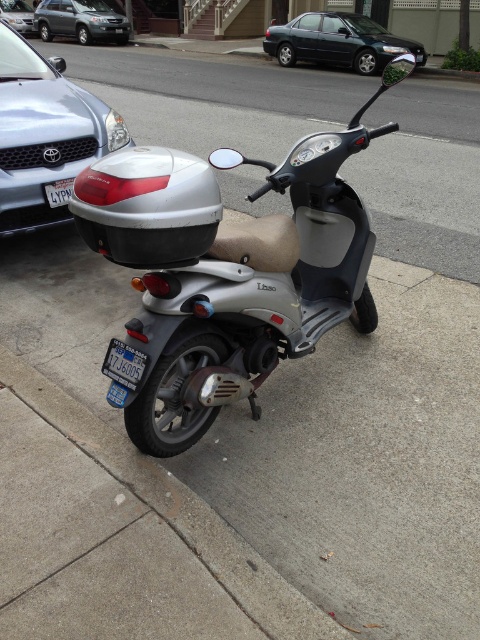
You are standing on the sidewalk and see a point marked at coordinates (x=228, y=269). What object is located at that point?

The point at coordinates (x=228, y=269) indicates the silver metallic scooter at center.

Based on the photo, you are a delivery person who needs to park your scooter between two cars on the sidewalk. You see the silver metallic scooter at center and the metallic blue sedan at center. Which direction should you move your scooter to park it between them?

The silver metallic scooter at center is already to the left of the metallic blue sedan at center, so you should move it to the right to park between them.

You are a delivery person who needs to attach a GPS tracker to the scooter. The tracker requires a minimum width of 12 cm to be securely attached. Which license plate on the scooter should you choose between the blue metallic license plate at lower center and the white plastic license plate at center?

The blue metallic license plate at lower center has a greater width than the white plastic license plate at center. Since the GPS tracker requires a minimum width of 12 cm, you should choose the blue metallic license plate at lower center if its width meets or exceeds 12 cm.